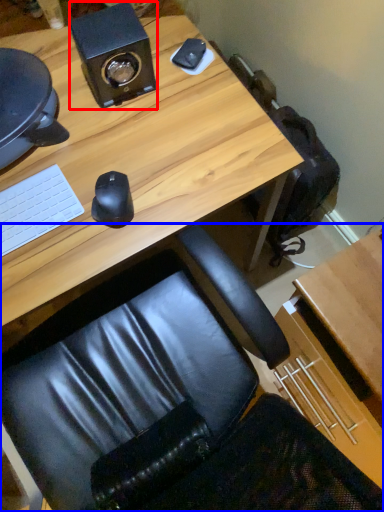
Question: Which object is closer to the camera taking this photo, speaker (highlighted by a red box) or chair (highlighted by a blue box)?

Choices:
 (A) speaker
 (B) chair

Answer: (B)